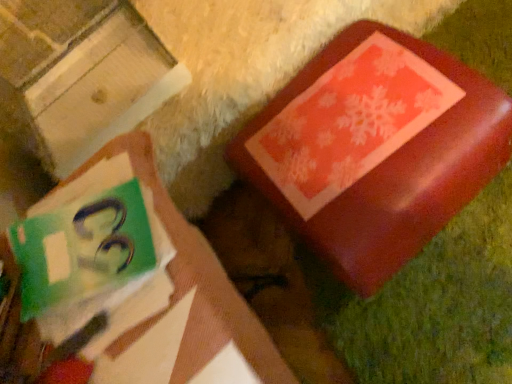
The height and width of the screenshot is (384, 512). In order to click on matte green book at upper left in this screenshot , I will do `click(133, 281)`.

This screenshot has width=512, height=384. I want to click on shiny red box at upper right, so click(x=375, y=149).

In order to face matte red box at upper right, should I rotate leftwards or rightwards?

A 25.646 degree turn to the left will do.

Image resolution: width=512 pixels, height=384 pixels. What do you see at coordinates (83, 73) in the screenshot? I see `matte red box at upper right` at bounding box center [83, 73].

Where is `matte green book at upper left`? This screenshot has width=512, height=384. matte green book at upper left is located at coordinates (133, 281).

Which of these two, matte green book at upper left or shiny red box at upper right, is smaller?

shiny red box at upper right.

Which is more to the right, matte green book at upper left or shiny red box at upper right?

Positioned to the right is shiny red box at upper right.

Identify the location of furniture on the right of matte green book at upper left. (375, 149).

Considering the positions of objects matte green book at upper left and matte red box at upper right in the image provided, who is more to the left, matte green book at upper left or matte red box at upper right?

From the viewer's perspective, matte red box at upper right appears more on the left side.

Is matte red box at upper right completely or partially inside matte green book at upper left?

No, matte green book at upper left does not contain matte red box at upper right.

Can you tell me how much matte green book at upper left and matte red box at upper right differ in facing direction?

matte green book at upper left and matte red box at upper right are facing 91.9 degrees away from each other.

Is matte green book at upper left positioned with its back to matte red box at upper right?

No, matte red box at upper right is not at the back of matte green book at upper left.

Consider the image. Measure the distance from matte red box at upper right to shiny red box at upper right.

matte red box at upper right and shiny red box at upper right are 21.19 inches apart from each other.

Which of these two, matte red box at upper right or shiny red box at upper right, stands shorter?

Standing shorter between the two is shiny red box at upper right.

Does matte red box at upper right have a larger size compared to shiny red box at upper right?

No.

Which is more to the left, matte red box at upper right or shiny red box at upper right?

matte red box at upper right.

From the image's perspective, is shiny red box at upper right positioned above or below matte red box at upper right?

Based on their image positions, shiny red box at upper right is located beneath matte red box at upper right.

Is shiny red box at upper right situated inside matte red box at upper right or outside?

shiny red box at upper right lies outside matte red box at upper right.

How far apart are shiny red box at upper right and matte red box at upper right?

shiny red box at upper right and matte red box at upper right are 53.82 centimeters apart.

From a real-world perspective, is matte red box at upper right physically located above or below matte green book at upper left?

matte red box at upper right is situated higher than matte green book at upper left in the real world.

Is matte red box at upper right bigger than matte green book at upper left?

Actually, matte red box at upper right might be smaller than matte green book at upper left.

Are shiny red box at upper right and matte green book at upper left beside each other?

There is a gap between shiny red box at upper right and matte green book at upper left.

From a real-world perspective, is shiny red box at upper right located higher than matte green book at upper left?

No, from a real-world perspective, shiny red box at upper right is not over matte green book at upper left

At what (x,y) coordinates should I click in order to perform the action: click on furniture on the right of matte green book at upper left. Please return your answer as a coordinate pair (x, y). This screenshot has height=384, width=512. Looking at the image, I should click on (375, 149).

Choose the correct answer: Is shiny red box at upper right inside matte green book at upper left or outside it?

shiny red box at upper right is located beyond the bounds of matte green book at upper left.

In the image, there is a matte green book at upper left. Identify the location of furniture above it (from the image's perspective). (375, 149).

The image size is (512, 384). I want to click on cardboard box that is behind the matte green book at upper left, so click(x=83, y=73).

From the image, which object appears to be farther from matte red box at upper right, matte green book at upper left or shiny red box at upper right?

matte green book at upper left.

Based on their spatial positions, is shiny red box at upper right or matte red box at upper right further from matte green book at upper left?

Among the two, matte red box at upper right is located further to matte green book at upper left.

From the image, which object appears to be farther from shiny red box at upper right, matte red box at upper right or matte green book at upper left?

Based on the image, matte red box at upper right appears to be further to shiny red box at upper right.

Estimate the real-world distances between objects in this image. Which object is further from matte red box at upper right, shiny red box at upper right or matte green book at upper left?

matte green book at upper left.

Considering their positions, is matte red box at upper right positioned further to matte green book at upper left than shiny red box at upper right?

matte red box at upper right lies further to matte green book at upper left than the other object.

From the image, which object appears to be farther from shiny red box at upper right, matte green book at upper left or matte red box at upper right?

matte red box at upper right is further to shiny red box at upper right.

Identify the location of book located between matte red box at upper right and shiny red box at upper right in the left-right direction. (133, 281).